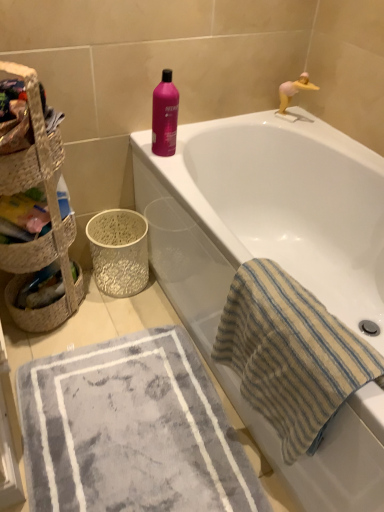
You are a GUI agent. You are given a task and a screenshot of the screen. Output one action in this format:
    pyautogui.click(x=<x>, y=<y>)
    Task: Click on the free spot above gray plush bath mat at lower left (from a real-world perspective)
    
    Given the screenshot: What is the action you would take?
    pyautogui.click(x=148, y=430)